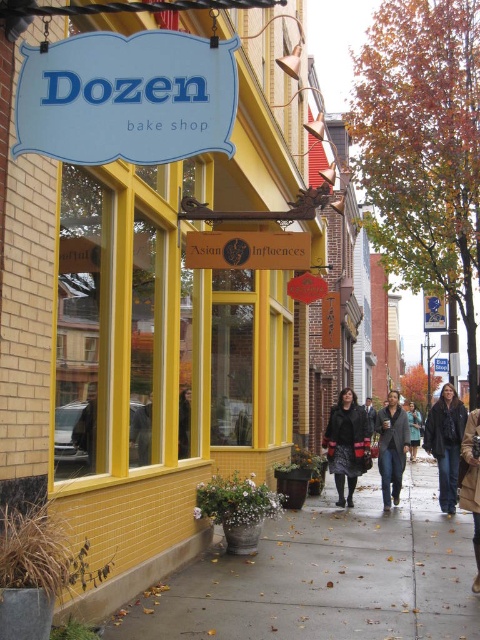
Consider the image. Is denim jacket at lower right thinner than brown leather jacket at lower right?

Yes, denim jacket at lower right is thinner than brown leather jacket at lower right.

Which of these two, denim jacket at lower right or brown leather jacket at lower right, stands shorter?

With less height is denim jacket at lower right.

You are a GUI agent. You are given a task and a screenshot of the screen. Output one action in this format:
    pyautogui.click(x=<x>, y=<y>)
    Task: Click on the denim jacket at lower right
    The height and width of the screenshot is (640, 480).
    Given the screenshot: What is the action you would take?
    pyautogui.click(x=445, y=442)

Identify the location of denim jacket at lower right. (445, 442).

Is denim jacket at lower right bigger than dark gray sweater at center?

No, denim jacket at lower right is not bigger than dark gray sweater at center.

Does point (443, 460) come farther from viewer compared to point (388, 403)?

That is False.

This screenshot has width=480, height=640. I want to click on denim jacket at lower right, so click(445, 442).

Does yellow brick bake shop sign at upper left have a greater width compared to brown leather jacket at lower right?

Indeed, yellow brick bake shop sign at upper left has a greater width compared to brown leather jacket at lower right.

The width and height of the screenshot is (480, 640). Describe the element at coordinates (151, 324) in the screenshot. I see `yellow brick bake shop sign at upper left` at that location.

Does point (87, 224) come closer to viewer compared to point (476, 496)?

Yes.

The width and height of the screenshot is (480, 640). I want to click on yellow brick bake shop sign at upper left, so click(x=151, y=324).